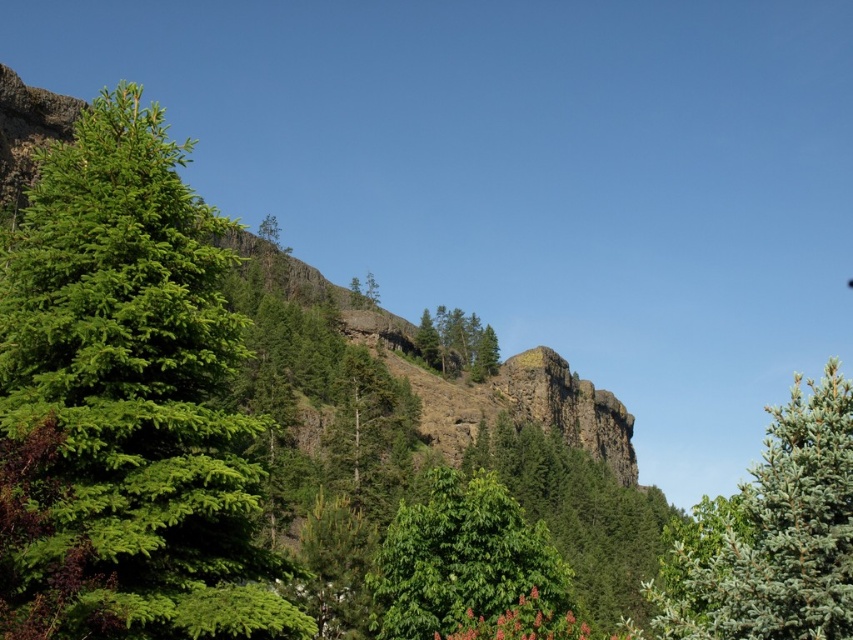
Question: Which point is farther to the camera?

Choices:
 (A) green leafy tree at center
 (B) green matte tree at upper center
 (C) brown rocky mountain at center

Answer: (B)

Question: Which of these objects is positioned farthest from the green leafy tree at center?

Choices:
 (A) green matte tree at upper center
 (B) green matte tree at left
 (C) brown rocky mountain at center
 (D) green matte tree at right

Answer: (A)

Question: Is green matte tree at right closer to the viewer compared to green matte tree at upper center?

Choices:
 (A) yes
 (B) no

Answer: (A)

Question: Where is green matte tree at right located in relation to green matte tree at upper center in the image?

Choices:
 (A) below
 (B) above

Answer: (A)

Question: Which of these objects is positioned closest to the green leafy tree at center?

Choices:
 (A) brown rocky mountain at center
 (B) green matte tree at right

Answer: (B)

Question: Can you confirm if green matte tree at left is thinner than brown rocky mountain at center?

Choices:
 (A) yes
 (B) no

Answer: (A)